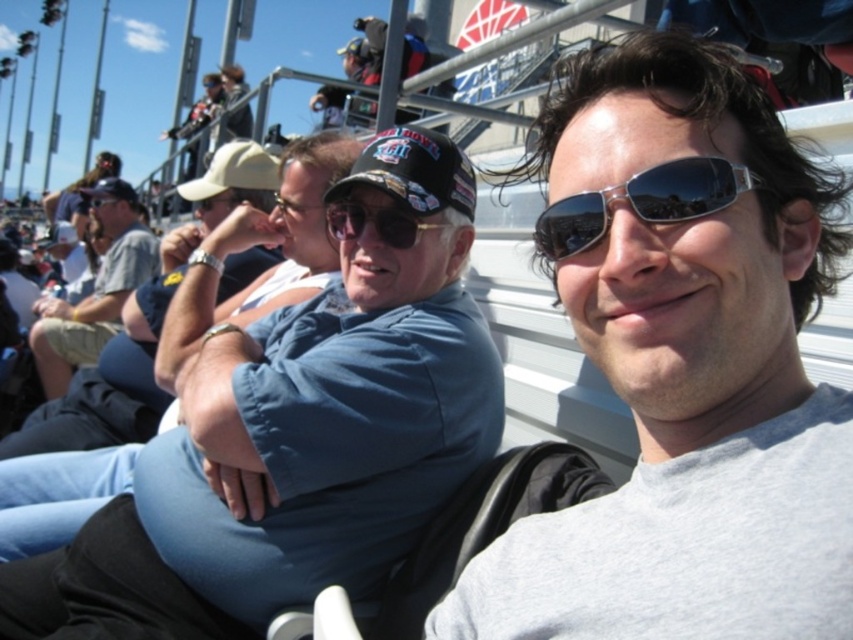
Question: Can you confirm if gray matte shirt at center is positioned to the left of light blue shirt at center?

Choices:
 (A) no
 (B) yes

Answer: (A)

Question: Which object appears farthest from the camera in this image?

Choices:
 (A) matte black sunglasses at center
 (B) light blue shirt at center

Answer: (B)

Question: Among these points, which one is farthest from the camera?

Choices:
 (A) (97, 204)
 (B) (405, 228)

Answer: (A)

Question: Does light blue shirt at center have a lesser width compared to matte black goggles at upper center?

Choices:
 (A) no
 (B) yes

Answer: (A)

Question: Which of the following is the farthest from the observer?

Choices:
 (A) matte black sunglasses at center
 (B) matte black goggles at upper center

Answer: (B)

Question: Does light blue shirt at center have a smaller size compared to matte black goggles at upper center?

Choices:
 (A) yes
 (B) no

Answer: (B)